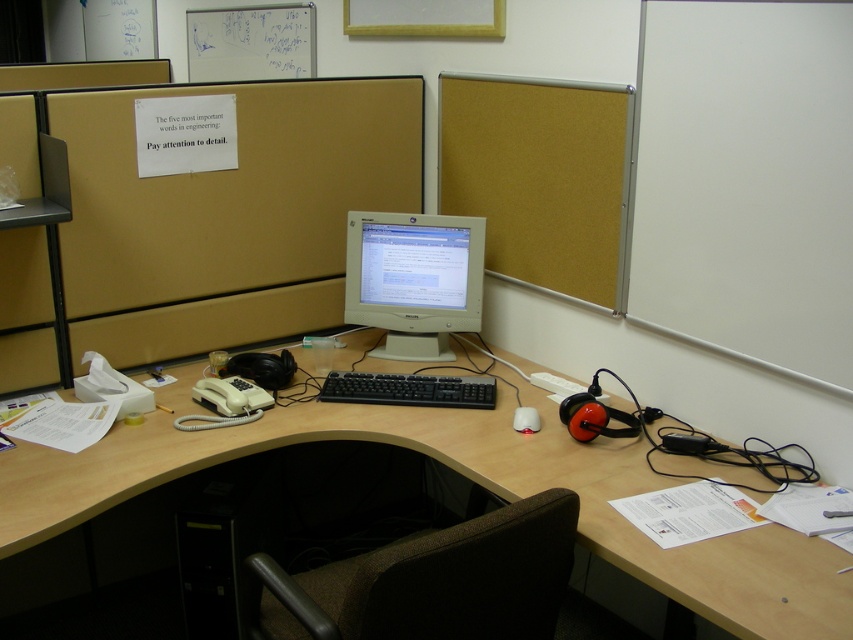
Question: Which point is closer to the camera taking this photo?

Choices:
 (A) (410, 396)
 (B) (509, 124)
 (C) (537, 429)
 (D) (444, 292)

Answer: (C)

Question: Considering the relative positions of matte plastic monitor at center and white matte mouse at center in the image provided, where is matte plastic monitor at center located with respect to white matte mouse at center?

Choices:
 (A) left
 (B) right

Answer: (A)

Question: Based on their relative distances, which object is nearer to the matte plastic monitor at center?

Choices:
 (A) brown fabric swivel chair at lower center
 (B) white glossy computer monitor at center
 (C) corkboard at upper center

Answer: (B)

Question: Can you confirm if white glossy computer monitor at center is wider than white matte mouse at center?

Choices:
 (A) yes
 (B) no

Answer: (A)

Question: Is brown fabric swivel chair at lower center thinner than white glossy computer monitor at center?

Choices:
 (A) yes
 (B) no

Answer: (B)

Question: Among these objects, which one is nearest to the camera?

Choices:
 (A) matte plastic monitor at center
 (B) wooden desk at center

Answer: (B)